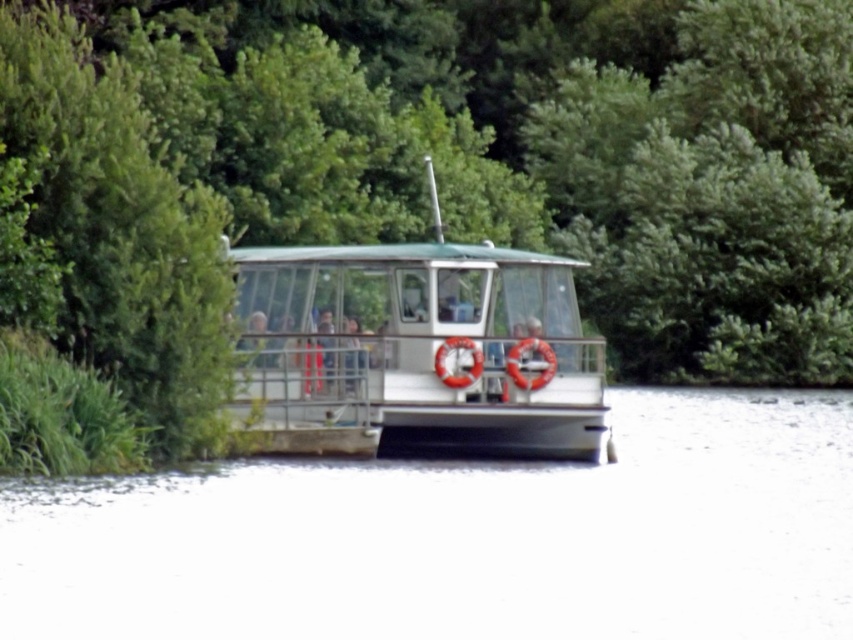
You are a photographer planning to take a photo of the green leafy tree at center and the white glossy boat at center from the shore. Which object should you focus on first if you want to capture both in the same frame without moving the camera?

The green leafy tree at center is larger in size than the white glossy boat at center, so you should focus on the green leafy tree at center first to ensure it fits properly in the frame before adjusting for the smaller boat.

From the picture: You are a photographer taking a picture of the boat from the shore. You notice two points marked on your camera screen at coordinates point (840, 582) and point (544, 424). Which point will appear larger in the photo?

Point (840, 582) is closer to the camera than point (544, 424), so it will appear larger in the photo.

Based on the photo, you are on a boat ride and notice a green leafy tree at center and a white smooth water at center. Which object is positioned to the left side from your perspective?

The green leafy tree at center is positioned to the left of the white smooth water at center.